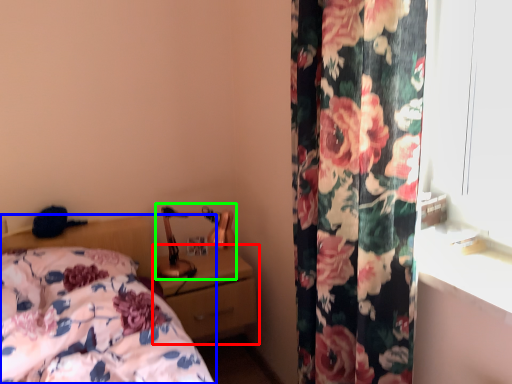
Question: Which object is the closest to the nightstand (highlighted by a red box)? Choose among these: bed (highlighted by a blue box) or table lamp (highlighted by a green box).

Choices:
 (A) bed
 (B) table lamp

Answer: (B)